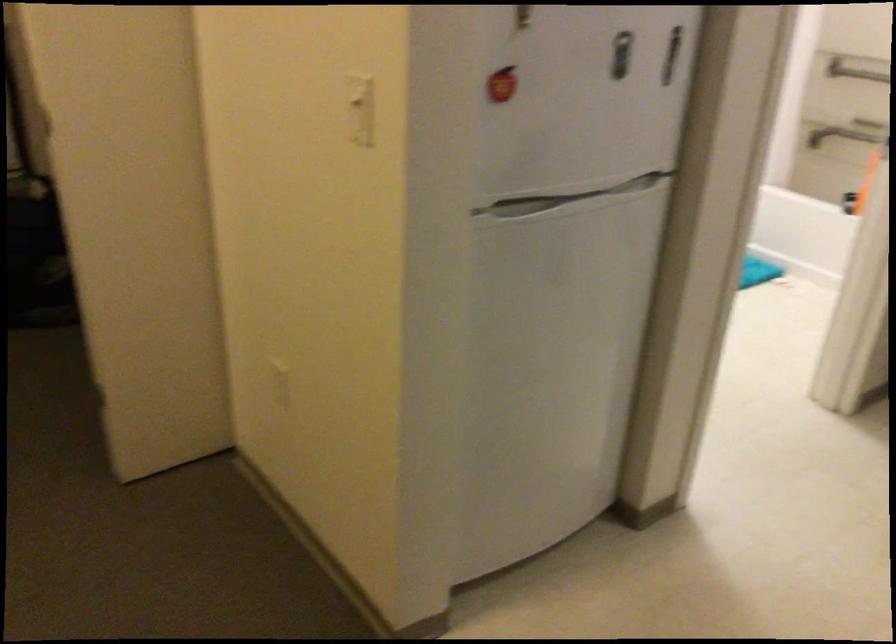
At what (x,y) coordinates should I click in order to perform the action: click on refrigerator handle. Please return your answer as a coordinate pair (x, y). The height and width of the screenshot is (644, 896). Looking at the image, I should click on (670, 55).